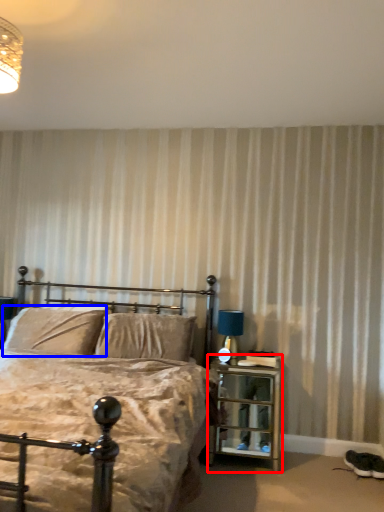
Question: Which of the following is the farthest to the observer, nightstand (highlighted by a red box) or pillow (highlighted by a blue box)?

Choices:
 (A) nightstand
 (B) pillow

Answer: (B)